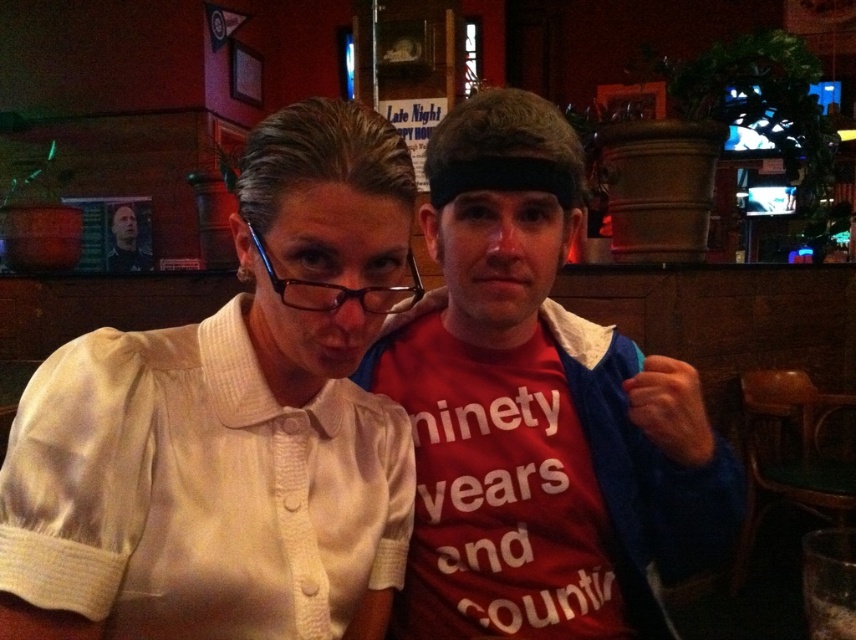
Question: Among these objects, which one is nearest to the camera?

Choices:
 (A) matte black hair at upper left
 (B) white satin blouse at center

Answer: (B)

Question: Among these objects, which one is farthest from the camera?

Choices:
 (A) red matte t-shirt at center
 (B) white satin blouse at center
 (C) matte black hair at upper left

Answer: (C)

Question: Is red matte t-shirt at center thinner than matte black hair at upper left?

Choices:
 (A) no
 (B) yes

Answer: (A)

Question: From the image, what is the correct spatial relationship of white satin blouse at center in relation to matte black hair at upper left?

Choices:
 (A) left
 (B) right

Answer: (B)

Question: Does white satin blouse at center appear on the right side of matte black hair at upper left?

Choices:
 (A) yes
 (B) no

Answer: (A)

Question: Which object is the farthest from the matte black hair at upper left?

Choices:
 (A) white satin blouse at center
 (B) red matte t-shirt at center

Answer: (A)